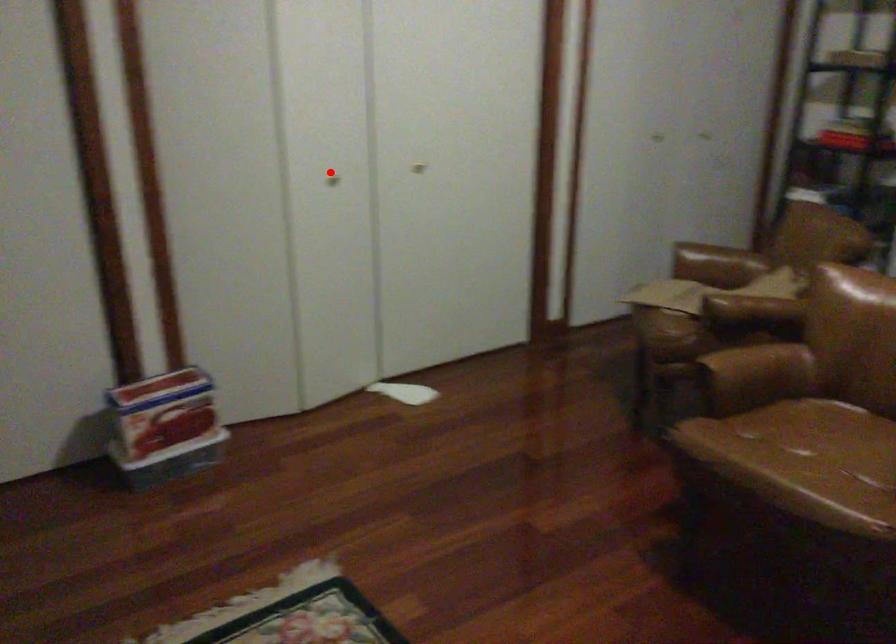
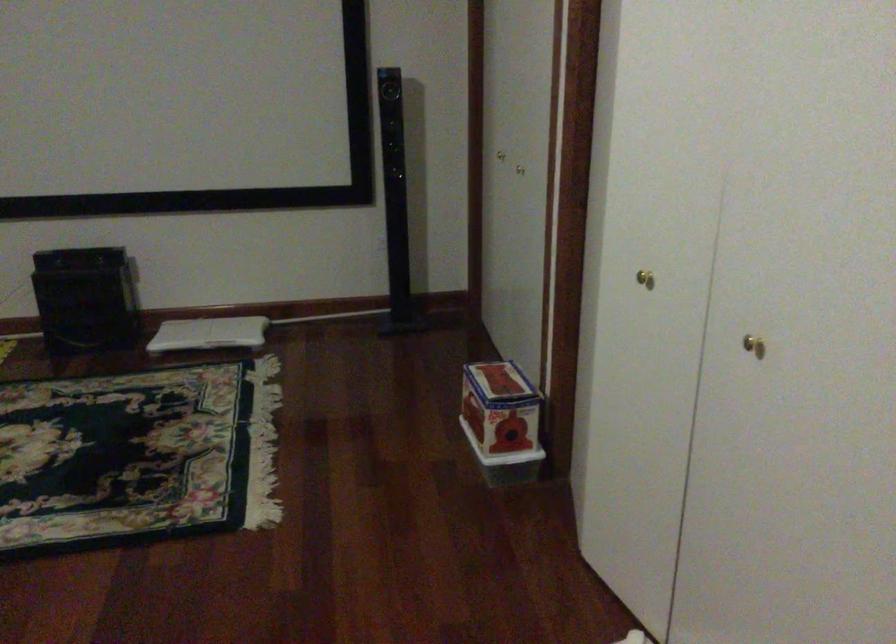
The point at the highlighted location is marked in the first image. Where is the corresponding point in the second image?

(644, 279)